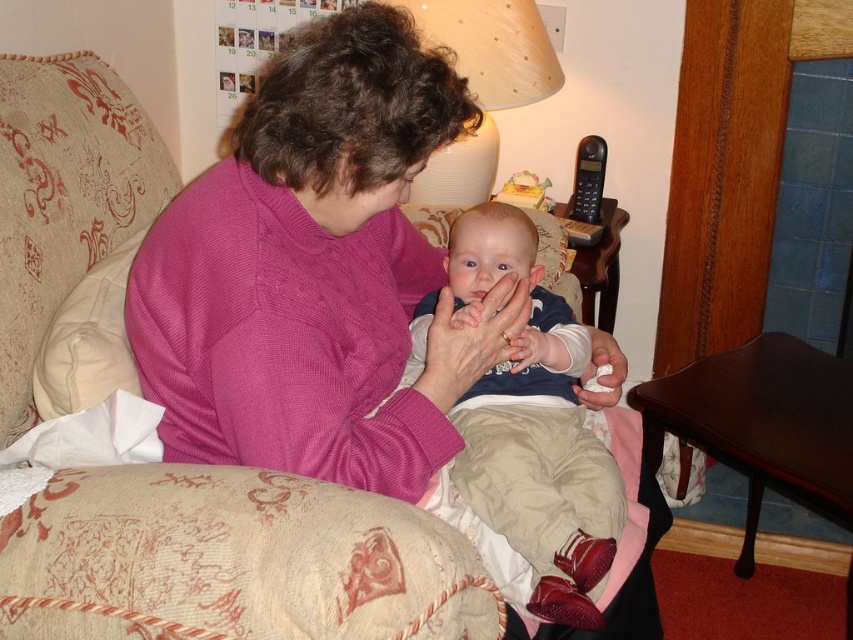
Question: Is pink knitted sweater at center bigger than smooth beige pants at center?

Choices:
 (A) no
 (B) yes

Answer: (B)

Question: Which of the following is the closest to the observer?

Choices:
 (A) beige fabric lampshade at upper center
 (B) smooth beige pants at center

Answer: (B)

Question: Can you confirm if smooth beige pants at center is positioned below beige fabric lampshade at upper center?

Choices:
 (A) no
 (B) yes

Answer: (B)

Question: Does pink knitted sweater at center appear over beige fabric lampshade at upper center?

Choices:
 (A) yes
 (B) no

Answer: (B)

Question: Which point appears farthest from the camera in this image?

Choices:
 (A) pos(544,422)
 (B) pos(335,346)
 (C) pos(445,202)

Answer: (C)

Question: Which object is the farthest from the beige fabric lampshade at upper center?

Choices:
 (A) pink knitted sweater at center
 (B) smooth beige pants at center

Answer: (A)